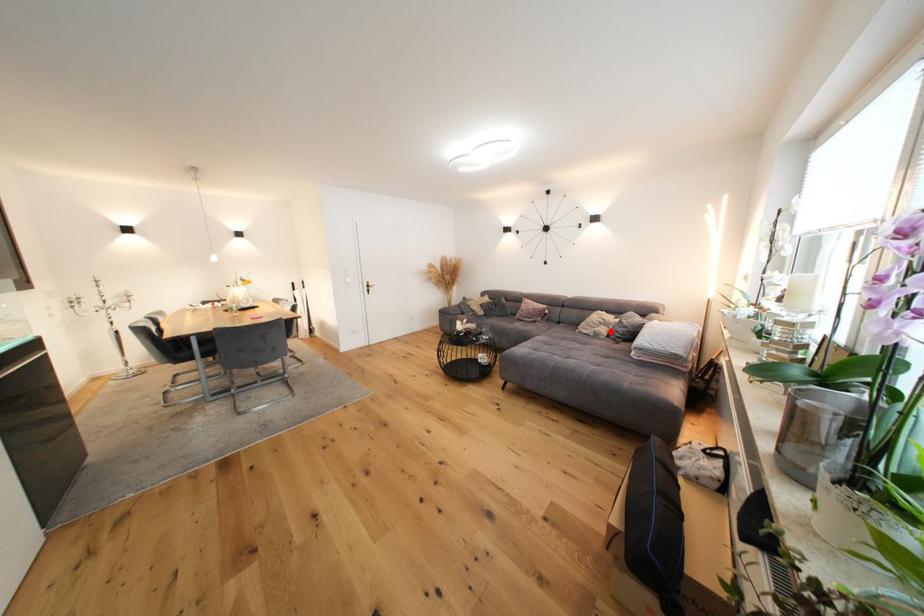
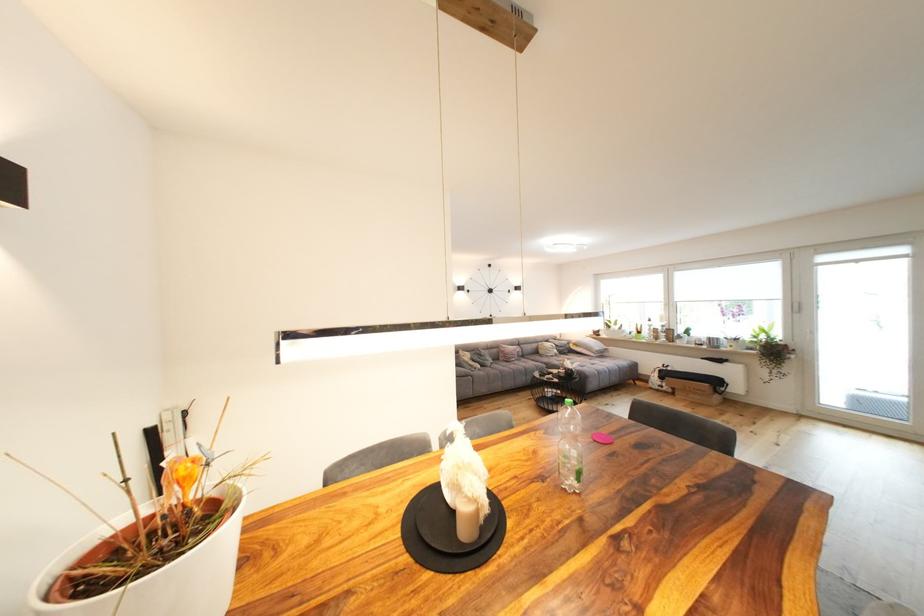
In the second image, find the point that corresponds to the highlighted location in the first image.

(563, 353)